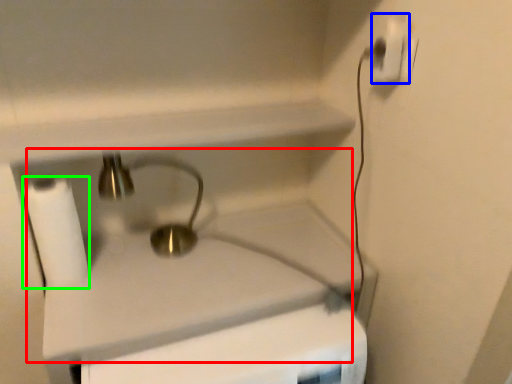
Question: Based on their relative distances, which object is nearer to sink (highlighted by a red box)? Choose from power plugs and sockets (highlighted by a blue box) and toilet paper (highlighted by a green box).

Choices:
 (A) power plugs and sockets
 (B) toilet paper

Answer: (B)